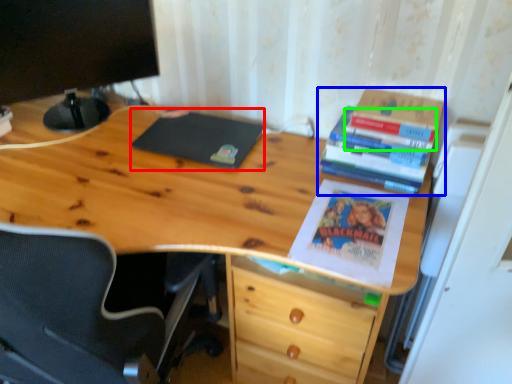
Question: Estimate the real-world distances between objects in this image. Which object is closer to notebook (highlighted by a red box), book (highlighted by a blue box) or book (highlighted by a green box)?

Choices:
 (A) book
 (B) book

Answer: (A)